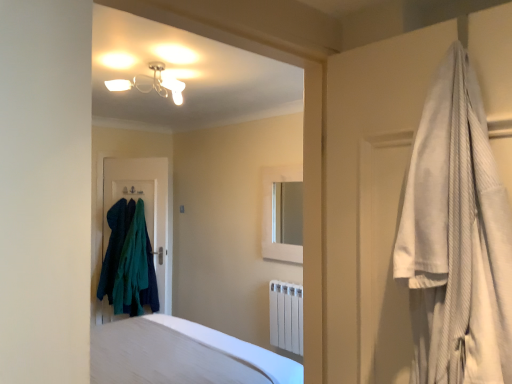
Question: Does white smooth bed at lower center have a larger size compared to dark teal fabric door at center?

Choices:
 (A) yes
 (B) no

Answer: (A)

Question: Can you confirm if white smooth bed at lower center is positioned to the right of dark teal fabric door at center?

Choices:
 (A) no
 (B) yes

Answer: (B)

Question: Considering the relative sizes of white smooth bed at lower center and dark teal fabric door at center in the image provided, is white smooth bed at lower center thinner than dark teal fabric door at center?

Choices:
 (A) no
 (B) yes

Answer: (A)

Question: Can you confirm if white smooth bed at lower center is wider than dark teal fabric door at center?

Choices:
 (A) yes
 (B) no

Answer: (A)

Question: From the image's perspective, is white smooth bed at lower center over dark teal fabric door at center?

Choices:
 (A) no
 (B) yes

Answer: (A)

Question: Considering the positions of white matte medicine cabinet at center and white textured robe at right in the image, is white matte medicine cabinet at center bigger or smaller than white textured robe at right?

Choices:
 (A) big
 (B) small

Answer: (A)

Question: Considering their positions, is white matte medicine cabinet at center located in front of or behind white textured robe at right?

Choices:
 (A) behind
 (B) front

Answer: (A)

Question: From their relative heights in the image, would you say white matte medicine cabinet at center is taller or shorter than white textured robe at right?

Choices:
 (A) tall
 (B) short

Answer: (A)

Question: Which is correct: white matte medicine cabinet at center is inside white textured robe at right, or outside of it?

Choices:
 (A) inside
 (B) outside

Answer: (B)

Question: Is white textured robe at right inside or outside of white matte medicine cabinet at center?

Choices:
 (A) inside
 (B) outside

Answer: (B)

Question: From a real-world perspective, is white textured robe at right physically located above or below white matte medicine cabinet at center?

Choices:
 (A) below
 (B) above

Answer: (B)

Question: Considering the positions of white textured robe at right and white matte medicine cabinet at center in the image, is white textured robe at right wider or thinner than white matte medicine cabinet at center?

Choices:
 (A) thin
 (B) wide

Answer: (B)

Question: From their relative heights in the image, would you say white textured robe at right is taller or shorter than white matte medicine cabinet at center?

Choices:
 (A) short
 (B) tall

Answer: (A)

Question: Considering the positions of white smooth bed at lower center and white textured robe at right in the image, is white smooth bed at lower center taller or shorter than white textured robe at right?

Choices:
 (A) tall
 (B) short

Answer: (B)

Question: Is white smooth bed at lower center bigger or smaller than white textured robe at right?

Choices:
 (A) small
 (B) big

Answer: (B)